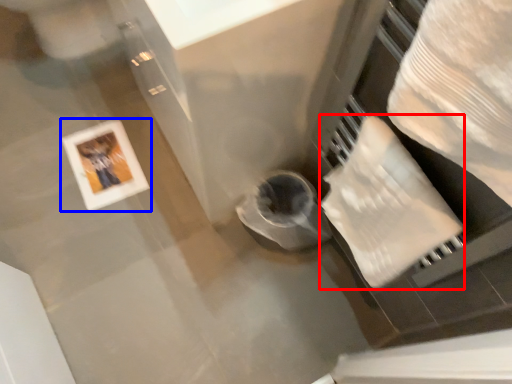
Question: Which of the following is the farthest to the observer, toilet paper (highlighted by a red box) or picture frame (highlighted by a blue box)?

Choices:
 (A) toilet paper
 (B) picture frame

Answer: (B)